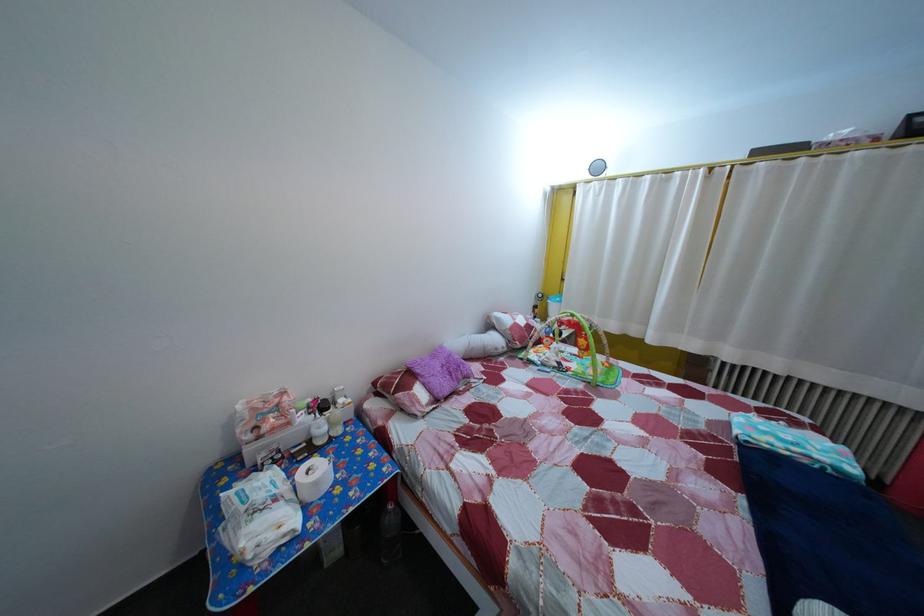
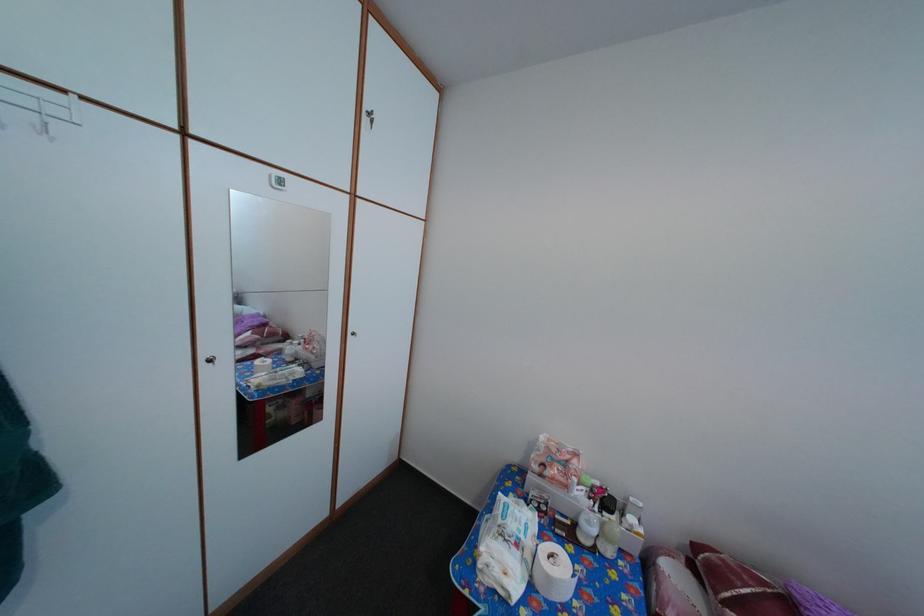
The point at (324, 440) is marked in the first image. Where is the corresponding point in the second image?

(592, 531)